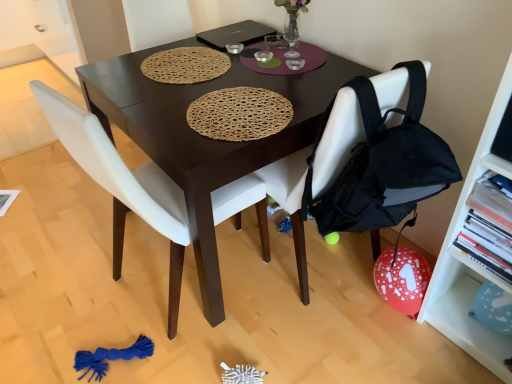
Question: Considering the relative positions of dark wood table at center and black fabric chair at center, positioned as the second chair in left-to-right order, in the image provided, is dark wood table at center to the left or to the right of black fabric chair at center, positioned as the second chair in left-to-right order,?

Choices:
 (A) right
 (B) left

Answer: (B)

Question: Is dark wood table at center bigger or smaller than black fabric chair at center, positioned as the second chair in left-to-right order?

Choices:
 (A) small
 (B) big

Answer: (B)

Question: Estimate the real-world distances between objects in this image. Which object is farther from the white matte chair at center, the first chair positioned from the left?

Choices:
 (A) black fabric chair at center, positioned as the second chair in left-to-right order
 (B) black matte laptop at upper center
 (C) dark wood table at center
 (D) white plastic shelf at right

Answer: (D)

Question: Estimate the real-world distances between objects in this image. Which object is farther from the black fabric chair at center, positioned as the second chair in left-to-right order?

Choices:
 (A) white plastic shelf at right
 (B) white matte chair at center, the first chair positioned from the left
 (C) black matte laptop at upper center
 (D) dark wood table at center

Answer: (C)